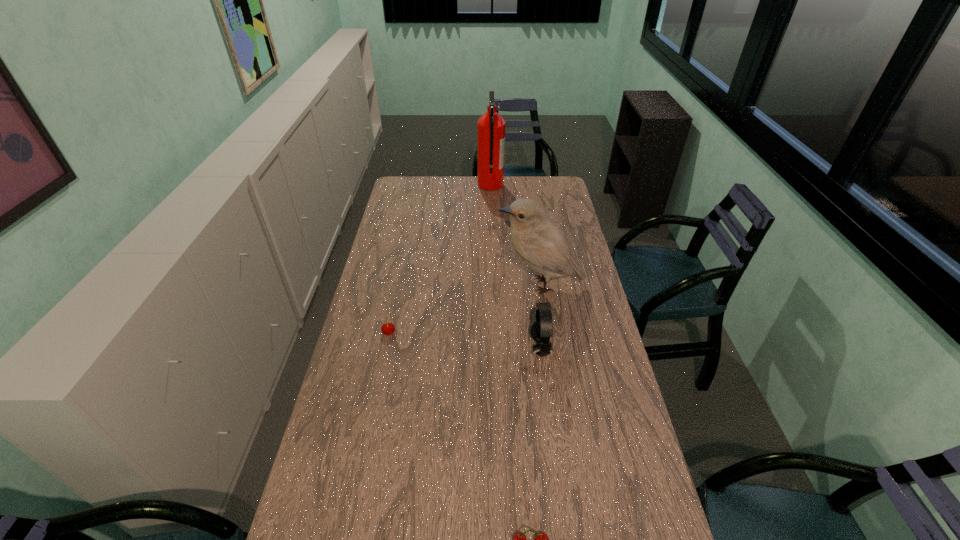
This screenshot has height=540, width=960. Find the location of `fire extinguisher`. fire extinguisher is located at coordinates (491, 127).

Where is `the farthest object`? the farthest object is located at coordinates (491, 127).

Locate an element on the screen. Image resolution: width=960 pixels, height=540 pixels. the second tallest object is located at coordinates (538, 241).

Locate an element on the screen. Image resolution: width=960 pixels, height=540 pixels. parakeet is located at coordinates (538, 241).

Locate an element on the screen. the third shortest object is located at coordinates (541, 330).

Find the location of a particular element. the leftmost object is located at coordinates (388, 328).

Find the location of a particular element. This screenshot has height=540, width=960. the farther cherry is located at coordinates (388, 328).

This screenshot has width=960, height=540. I want to click on free location located 0.120m at the nozzle of the fire extinguisher, so click(x=455, y=185).

Where is `vacant area situated 0.300m at the nozzle of the fire extinguisher`? Image resolution: width=960 pixels, height=540 pixels. vacant area situated 0.300m at the nozzle of the fire extinguisher is located at coordinates (420, 185).

The image size is (960, 540). I want to click on free region located at the nozzle of the fire extinguisher, so click(408, 185).